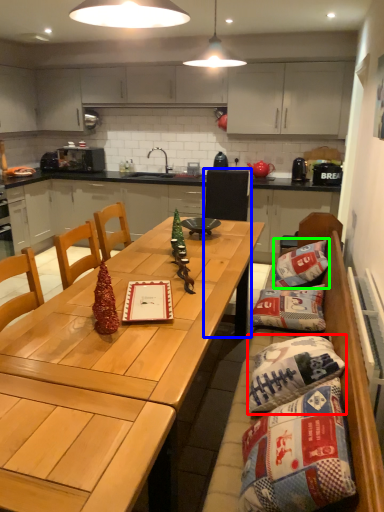
Question: Based on their relative distances, which object is farther from pillow (highlighted by a red box)? Choose from chair (highlighted by a blue box) and pillow (highlighted by a green box).

Choices:
 (A) chair
 (B) pillow

Answer: (A)